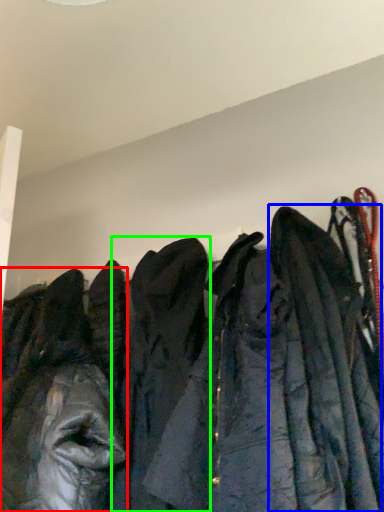
Question: Which is farther away from jacket (highlighted by a red box)? cloak (highlighted by a blue box) or cloak (highlighted by a green box)?

Choices:
 (A) cloak
 (B) cloak

Answer: (A)